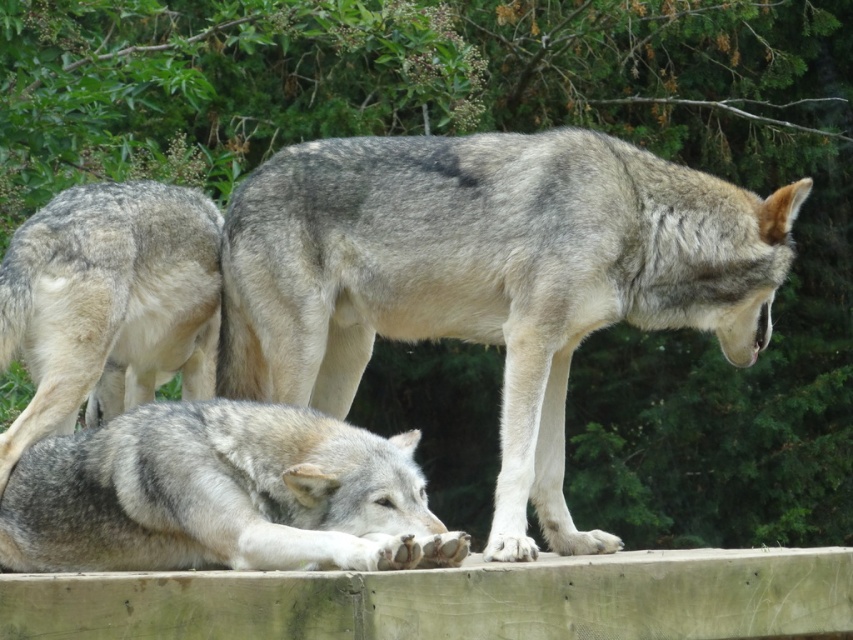
Question: Is gray fur wolf at center smaller than gray fur wolf at lower left?

Choices:
 (A) yes
 (B) no

Answer: (A)

Question: Which of the following is the farthest from the observer?

Choices:
 (A) gray fur wolf at center
 (B) fuzzy gray fur at lower left

Answer: (A)

Question: Which point is closer to the camera?

Choices:
 (A) fuzzy gray fur at lower left
 (B) gray fur wolf at center
 (C) gray fur wolf at lower left

Answer: (C)

Question: Which point is closer to the camera?

Choices:
 (A) gray fur wolf at lower left
 (B) gray fur wolf at center

Answer: (A)

Question: Is gray fur wolf at center positioned behind gray fur wolf at lower left?

Choices:
 (A) no
 (B) yes

Answer: (B)

Question: Observing the image, what is the correct spatial positioning of gray fur wolf at lower left in reference to fuzzy gray fur at lower left?

Choices:
 (A) above
 (B) below

Answer: (B)